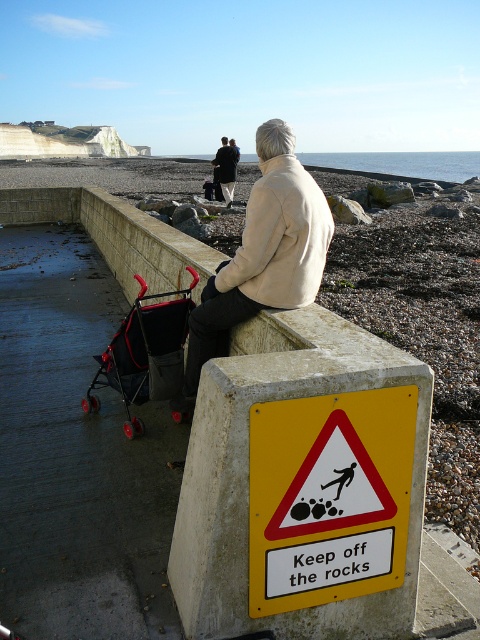
Does beige woolen jacket at center appear over dark blue jeans at center?

Incorrect, beige woolen jacket at center is not positioned above dark blue jeans at center.

From the picture: Is beige woolen jacket at center below dark blue jeans at center?

Correct, beige woolen jacket at center is located below dark blue jeans at center.

Where is `beige woolen jacket at center`? This screenshot has height=640, width=480. beige woolen jacket at center is located at coordinates (263, 253).

Does beige woolen jacket at center appear on the left side of black mesh stroller at lower left?

Incorrect, beige woolen jacket at center is not on the left side of black mesh stroller at lower left.

Is beige woolen jacket at center further to the viewer compared to black mesh stroller at lower left?

No, beige woolen jacket at center is closer to the viewer.

Identify the location of beige woolen jacket at center. The width and height of the screenshot is (480, 640). (263, 253).

What are the coordinates of `beige woolen jacket at center` in the screenshot? It's located at (263, 253).

Is point (103, 368) in front of point (224, 193)?

Yes, it is in front of point (224, 193).

Can you confirm if black mesh stroller at lower left is positioned to the left of dark blue jeans at center?

In fact, black mesh stroller at lower left is to the right of dark blue jeans at center.

Between point (153, 364) and point (228, 147), which one is positioned behind?

Point (228, 147)

Locate an element on the screen. black mesh stroller at lower left is located at coordinates (144, 353).